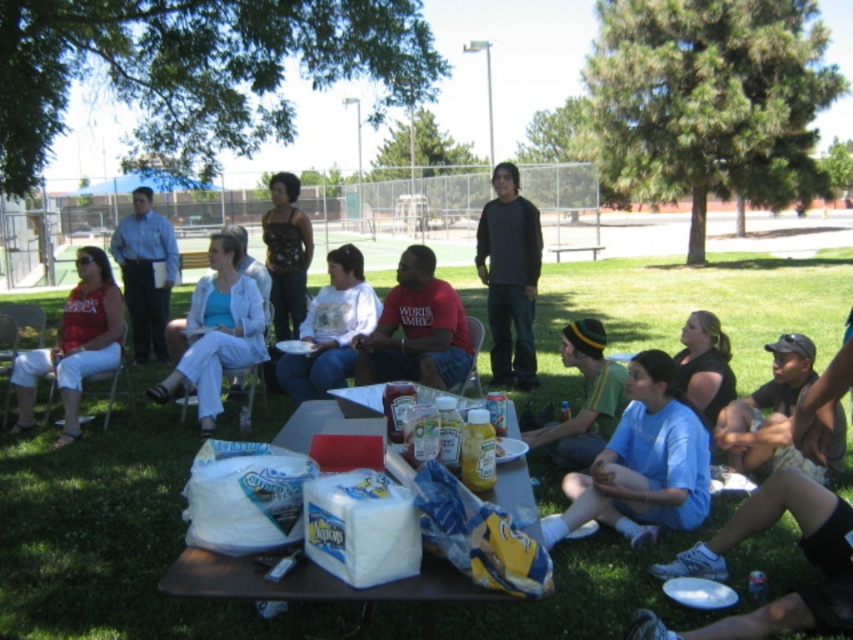
You are at a park picnic and see two people sitting at the table. One is wearing a light blue fabric shirt at center and the other has a green knit cap at center. From your perspective, which person is sitting to the right of the other?

The light blue fabric shirt at center is to the left of the green knit cap at center, so the green knit cap at center is to the right of the light blue fabric shirt at center.